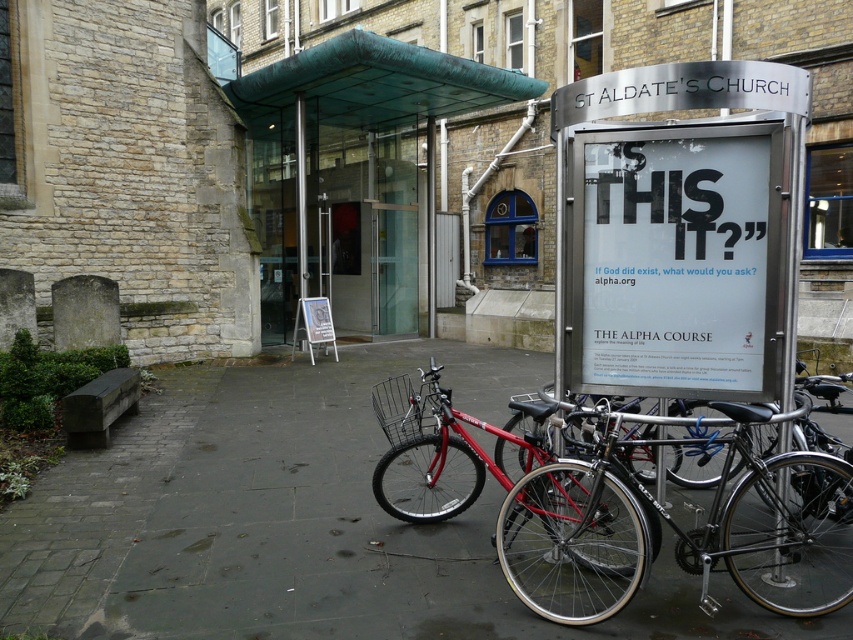
Who is more forward, [738,593] or [276,76]?

Positioned in front is point [738,593].

Which is behind, point (358, 627) or point (358, 70)?

The point (358, 70) is behind.

Find the location of a particular element. paved stone pavement at center is located at coordinates (299, 522).

Which is below, transparent glass bus stop at upper center or shiny black bicycle at center?

shiny black bicycle at center

Does transparent glass bus stop at upper center appear on the left side of shiny black bicycle at center?

Yes, transparent glass bus stop at upper center is to the left of shiny black bicycle at center.

Is point (271, 113) farther from camera compared to point (628, 579)?

That is True.

This screenshot has height=640, width=853. I want to click on transparent glass bus stop at upper center, so click(x=358, y=177).

Does white paper sign at center come in front of shiny red bicycle at center?

Yes, white paper sign at center is in front of shiny red bicycle at center.

Who is positioned more to the right, white paper sign at center or shiny red bicycle at center?

white paper sign at center

Does point (572, 172) come in front of point (395, 483)?

That is True.

Identify the location of white paper sign at center. This screenshot has width=853, height=640. (676, 266).